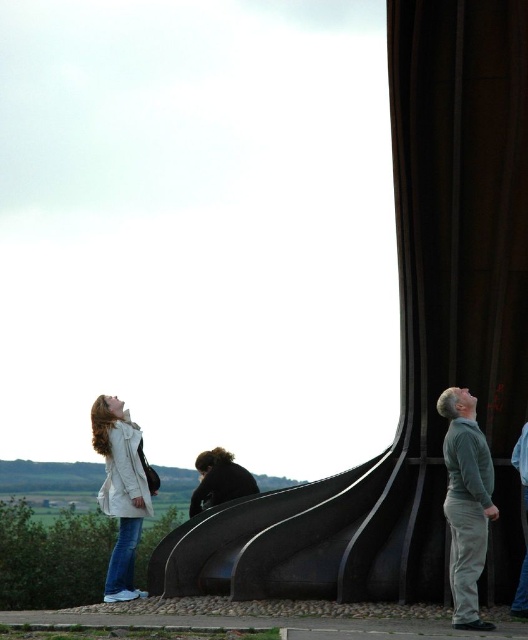
You are standing in front of the sculpture and want to walk from the black matte curtain at right to the white matte jacket at lower left. Which direction should you move relative to the sculpture?

Since the black matte curtain at right is closer to the viewer than the white matte jacket at lower left, you should move away from the sculpture towards the lower left direction to reach the white matte jacket at lower left.

You are an artist planning to paint the scene. You want to ensure the black matte curtain at right is visible against the white matte jacket at lower left. Based on their positions, will the curtain be easily distinguishable from the jacket?

The black matte curtain at right is located above the white matte jacket at lower left. Since the curtain is positioned higher up and the jacket is lower down, they occupy different vertical spaces, making them easily distinguishable from each other.